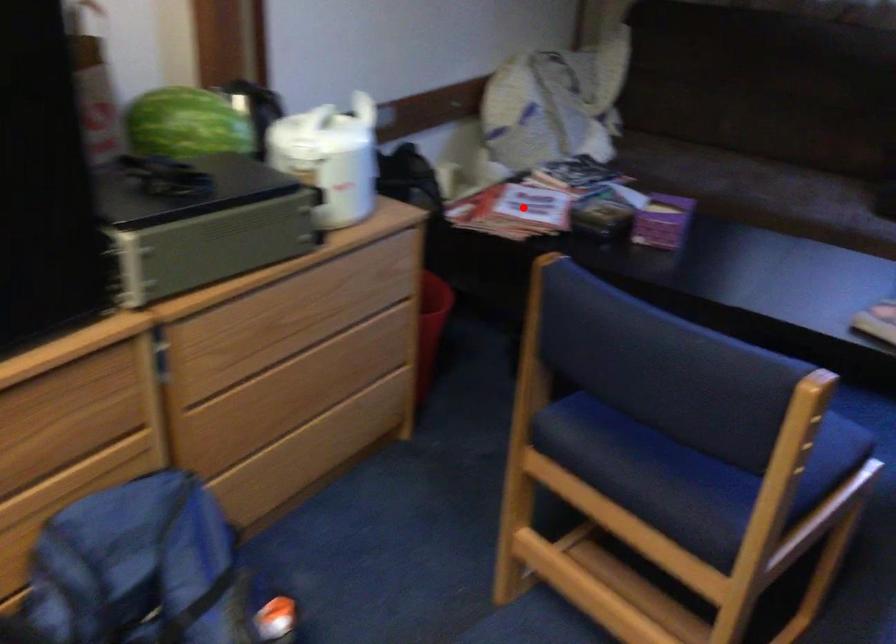
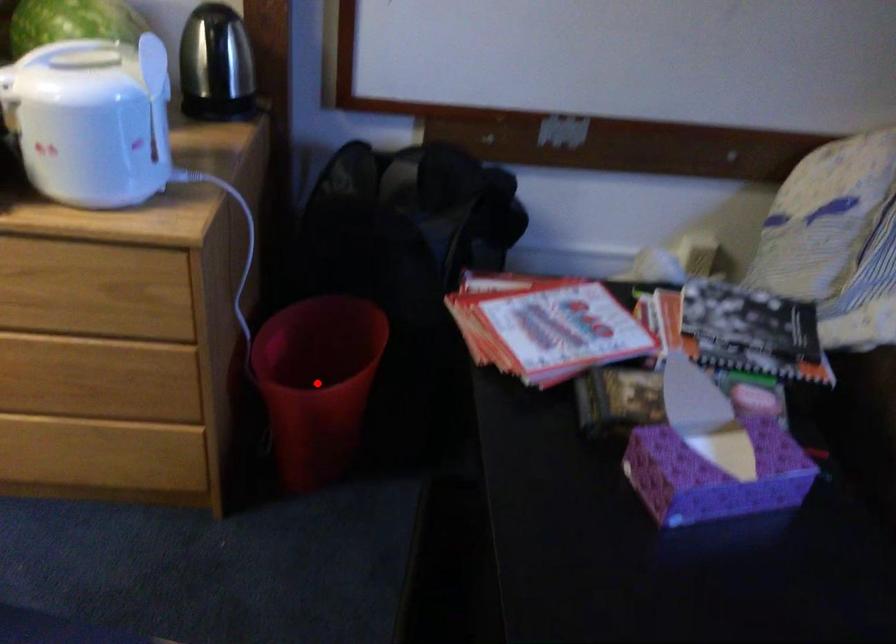
I am providing you with two images of the same scene from different viewpoints. A red point is marked on the first image and another point is marked on the second image. Do the highlighted points in image1 and image2 indicate the same real-world spot?

No